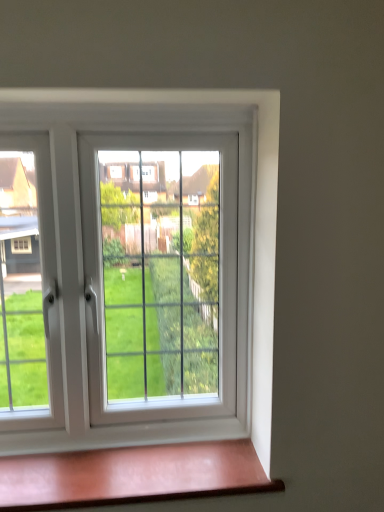
Question: Can you confirm if white plastic window at center is positioned to the right of matte pink wood at lower center?

Choices:
 (A) yes
 (B) no

Answer: (B)

Question: Is white plastic window at center facing towards matte pink wood at lower center?

Choices:
 (A) no
 (B) yes

Answer: (B)

Question: Is white plastic window at center closer to the viewer compared to matte pink wood at lower center?

Choices:
 (A) no
 (B) yes

Answer: (A)

Question: Is matte pink wood at lower center at the back of white plastic window at center?

Choices:
 (A) no
 (B) yes

Answer: (A)

Question: From a real-world perspective, is white plastic window at center positioned over matte pink wood at lower center based on gravity?

Choices:
 (A) no
 (B) yes

Answer: (B)

Question: Is white plastic window at center shorter than matte pink wood at lower center?

Choices:
 (A) yes
 (B) no

Answer: (B)

Question: Is matte pink wood at lower center taller than white plastic window at center?

Choices:
 (A) yes
 (B) no

Answer: (B)

Question: Is matte pink wood at lower center at the right side of white plastic window at center?

Choices:
 (A) yes
 (B) no

Answer: (A)

Question: Is the position of matte pink wood at lower center less distant than that of white plastic window at center?

Choices:
 (A) no
 (B) yes

Answer: (B)

Question: Would you say matte pink wood at lower center is outside white plastic window at center?

Choices:
 (A) yes
 (B) no

Answer: (A)

Question: From the image's perspective, is matte pink wood at lower center above white plastic window at center?

Choices:
 (A) no
 (B) yes

Answer: (A)

Question: Can you confirm if matte pink wood at lower center is bigger than white plastic window at center?

Choices:
 (A) no
 (B) yes

Answer: (A)

Question: From a real-world perspective, relative to matte pink wood at lower center, is white plastic window at center vertically above or below?

Choices:
 (A) above
 (B) below

Answer: (A)